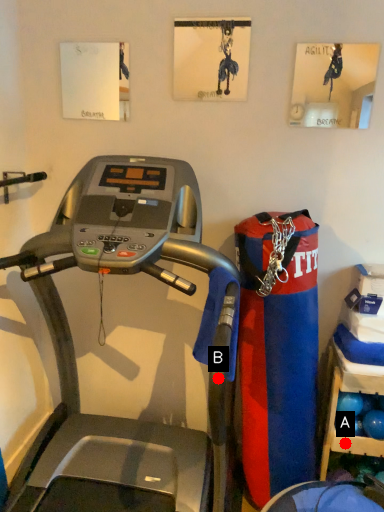
Question: Two points are circled on the image, labeled by A and B beside each circle. Which point is closer to the camera taking this photo?

Choices:
 (A) A is closer
 (B) B is closer

Answer: (B)